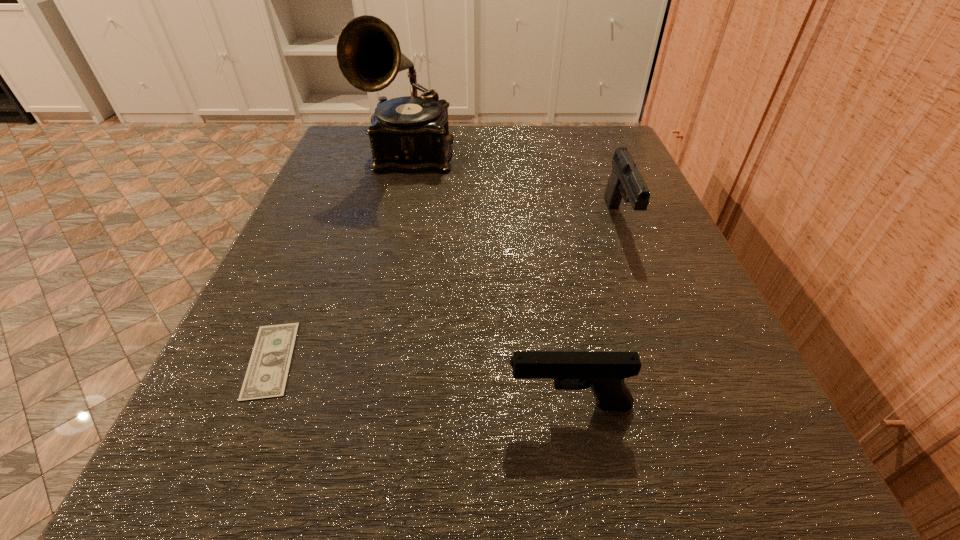
Where is `vacant space located on the front-facing side of the nearer pistol`? Image resolution: width=960 pixels, height=540 pixels. vacant space located on the front-facing side of the nearer pistol is located at coordinates (322, 405).

Locate an element on the screen. The image size is (960, 540). vacant space located on the front-facing side of the nearer pistol is located at coordinates (294, 405).

Identify the location of vacant space located 0.060m on the back of the shortest object. click(x=300, y=291).

At what (x,y) coordinates should I click in order to perform the action: click on object located in the far edge section of the desktop. Please return your answer as a coordinate pair (x, y). This screenshot has width=960, height=540. Looking at the image, I should click on (408, 134).

Locate an element on the screen. The height and width of the screenshot is (540, 960). phonograph record situated at the left edge is located at coordinates (408, 134).

Locate an element on the screen. This screenshot has height=540, width=960. money that is at the left edge is located at coordinates (266, 377).

Locate an element on the screen. object that is at the far left corner is located at coordinates (408, 134).

In the image, there is a desktop. Identify the location of blank space at the far edge. The width and height of the screenshot is (960, 540). (463, 132).

You are a GUI agent. You are given a task and a screenshot of the screen. Output one action in this format:
    pyautogui.click(x=<x>, y=<y>)
    Task: Click on the vacant space at the near edge
    Image resolution: width=960 pixels, height=540 pixels.
    Given the screenshot: What is the action you would take?
    pyautogui.click(x=444, y=532)

You are a GUI agent. You are given a task and a screenshot of the screen. Output one action in this format:
    pyautogui.click(x=<x>, y=<y>)
    Task: Click on the free space at the left edge of the desktop
    
    Given the screenshot: What is the action you would take?
    tap(339, 364)